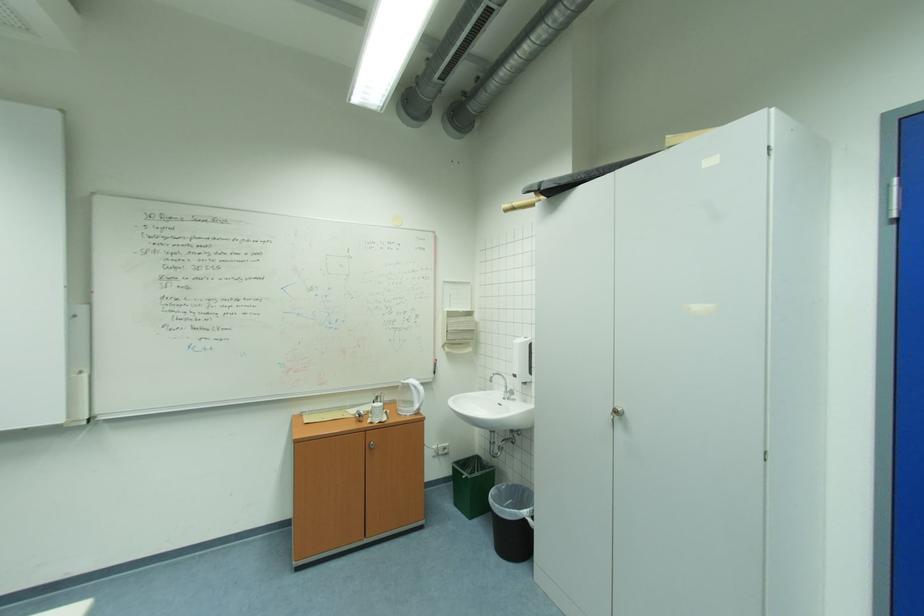
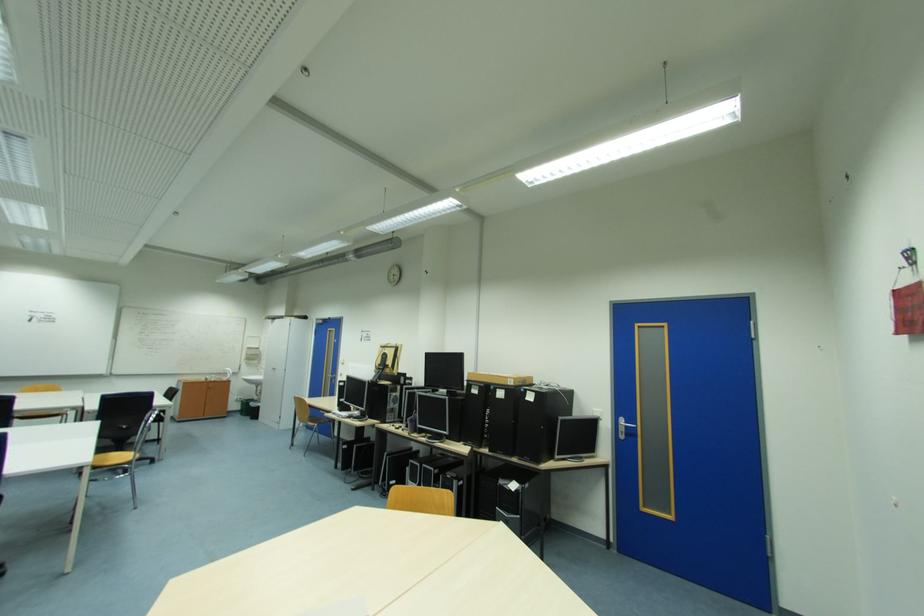
Where in the second image is the point corresponding to (x=464, y=505) from the first image?

(249, 416)